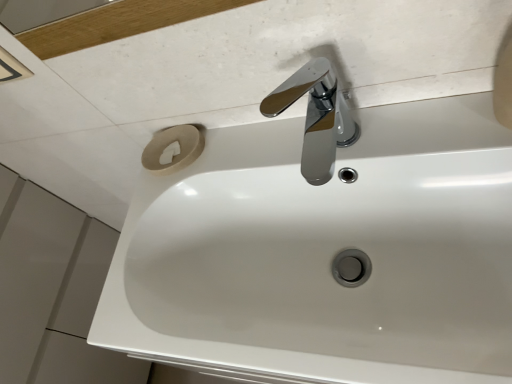
The image size is (512, 384). In order to click on free area behind chrome/metallic faucet at upper center in this screenshot , I will do [261, 143].